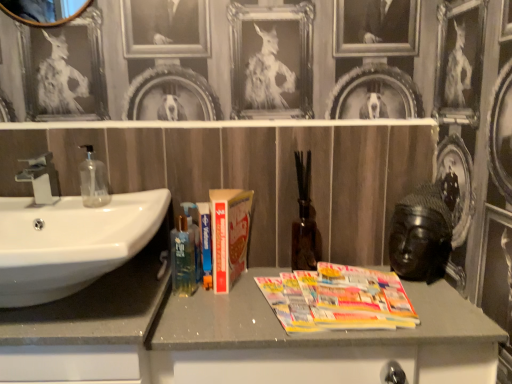
You are a GUI agent. You are given a task and a screenshot of the screen. Output one action in this format:
    pyautogui.click(x=<x>, y=<y>)
    Task: Click on the wooden mirror at upper left
    
    Given the screenshot: What is the action you would take?
    pyautogui.click(x=44, y=11)

What is the approximate height of white glossy sink at left?

19.51 centimeters.

At what (x,y) coordinates should I click in order to perform the action: click on matte gray cabinet at center. Please return your answer as a coordinate pair (x, y). Looking at the image, I should click on (318, 341).

What is the approximate width of matte silver faucet at left?

12.19 centimeters.

What is the approximate width of hardcover book at center?

It is 6.63 inches.

What do you see at coordinates (338, 299) in the screenshot? This screenshot has height=384, width=512. I see `multicolored glossy magazines at center` at bounding box center [338, 299].

You are a GUI agent. You are given a task and a screenshot of the screen. Output one action in this format:
    pyautogui.click(x=<x>, y=<y>)
    Task: Click on the translucent plastic mouthwash at lower left
    This screenshot has height=384, width=512.
    Given the screenshot: What is the action you would take?
    pyautogui.click(x=183, y=259)

What's the angular difference between white glossy sink at left and hardcover book at center's facing directions?

The facing directions of white glossy sink at left and hardcover book at center are 1.34 degrees apart.

Who is taller, white glossy sink at left or hardcover book at center?

With more height is hardcover book at center.

From a real-world perspective, is white glossy sink at left above or below hardcover book at center?

Clearly, from a real-world perspective, white glossy sink at left is above hardcover book at center.

Identify the location of paperback book located above the white glossy sink at left (from the image's perspective). The image size is (512, 384). (229, 235).

Between translucent plastic mouthwash at lower left and hardcover book at center, which one has smaller width?

With smaller width is hardcover book at center.

Is translucent plastic mouthwash at lower left looking in the opposite direction of hardcover book at center?

translucent plastic mouthwash at lower left is not turned away from hardcover book at center.

Locate an element on the screen. picture frame above the matte silver faucet at left (from a real-world perspective) is located at coordinates (44, 11).

Between wooden mirror at upper left and matte silver faucet at left, which one has larger size?

wooden mirror at upper left is bigger.

Which point is more distant from viewer, (x=32, y=5) or (x=41, y=187)?

Point (x=32, y=5)

Which of these two, wooden mirror at upper left or matte silver faucet at left, is thinner?

With smaller width is wooden mirror at upper left.

Is point (297, 305) closer or farther from the camera than point (270, 375)?

Point (297, 305) is farther from the camera than point (270, 375).

Is multicolored glossy magazines at center next to matte gray cabinet at center and touching it?

multicolored glossy magazines at center is not next to matte gray cabinet at center, and they're not touching.

From the image's perspective, which one is positioned higher, multicolored glossy magazines at center or matte gray cabinet at center?

From the image's view, multicolored glossy magazines at center is above.

Is multicolored glossy magazines at center oriented away from matte gray cabinet at center?

Yes.

Which object is closer to the camera taking this photo, multicolored glossy magazines at center or matte silver faucet at left?

multicolored glossy magazines at center.

From the image's perspective, relative to matte silver faucet at left, is multicolored glossy magazines at center above or below?

multicolored glossy magazines at center is situated lower than matte silver faucet at left in the image.

Which of these two, multicolored glossy magazines at center or matte silver faucet at left, is bigger?

Bigger between the two is matte silver faucet at left.

The height and width of the screenshot is (384, 512). Identify the location of magazine lying in front of the matte silver faucet at left. (338, 299).

Looking at their sizes, would you say matte gray cabinet at center is wider or thinner than multicolored glossy magazines at center?

Clearly, matte gray cabinet at center has more width compared to multicolored glossy magazines at center.

Is matte gray cabinet at center turned away from multicolored glossy magazines at center?

A: matte gray cabinet at center does not have its back to multicolored glossy magazines at center.

Based on their positions, is matte gray cabinet at center located to the left or right of multicolored glossy magazines at center?

matte gray cabinet at center is to the right of multicolored glossy magazines at center.

Is matte gray cabinet at center shorter than multicolored glossy magazines at center?

Incorrect, the height of matte gray cabinet at center does not fall short of that of multicolored glossy magazines at center.

Is translucent plastic mouthwash at lower left positioned behind matte silver faucet at left?

Yes, translucent plastic mouthwash at lower left is further from the viewer.

Can you confirm if translucent plastic mouthwash at lower left is taller than matte silver faucet at left?

Indeed, translucent plastic mouthwash at lower left has a greater height compared to matte silver faucet at left.

Which of these two, translucent plastic mouthwash at lower left or matte silver faucet at left, is thinner?

With smaller width is matte silver faucet at left.

How much distance is there between translucent plastic mouthwash at lower left and matte silver faucet at left?

The distance of translucent plastic mouthwash at lower left from matte silver faucet at left is 37.34 centimeters.

Image resolution: width=512 pixels, height=384 pixels. Find the location of `sink located above the hardcover book at center (from a real-world perspective)`. sink located above the hardcover book at center (from a real-world perspective) is located at coordinates (69, 240).

The height and width of the screenshot is (384, 512). Find the location of `mouthwash that is in front of the hardcover book at center`. mouthwash that is in front of the hardcover book at center is located at coordinates (183, 259).

From the image, which object appears to be nearer to multicolored glossy magazines at center, white glossy sink at left or wooden mirror at upper left?

white glossy sink at left lies closer to multicolored glossy magazines at center than the other object.

Based on their spatial positions, is matte silver faucet at left or translucent plastic mouthwash at lower left further from multicolored glossy magazines at center?

matte silver faucet at left lies further to multicolored glossy magazines at center than the other object.

From the image, which object appears to be farther from hardcover book at center, translucent plastic mouthwash at lower left or wooden mirror at upper left?

Based on the image, wooden mirror at upper left appears to be further to hardcover book at center.

Which object lies further to the anchor point wooden mirror at upper left, hardcover book at center or white glossy sink at left?

hardcover book at center.

From the image, which object appears to be nearer to translucent plastic mouthwash at lower left, hardcover book at center or wooden mirror at upper left?

hardcover book at center is positioned closer to the anchor translucent plastic mouthwash at lower left.

Based on the photo, estimate the real-world distances between objects in this image. Which object is further from hardcover book at center, matte gray cabinet at center or white glossy sink at left?

white glossy sink at left is further to hardcover book at center.

When comparing their distances from wooden mirror at upper left, does translucent plastic mouthwash at lower left or transparent glass soap dispenser at left seem closer?

transparent glass soap dispenser at left.

In the scene shown: When comparing their distances from matte gray cabinet at center, does matte silver faucet at left or white glossy sink at left seem closer?

Among the two, white glossy sink at left is located nearer to matte gray cabinet at center.

Image resolution: width=512 pixels, height=384 pixels. Find the location of `mouthwash situated between white glossy sink at left and matte gray cabinet at center from left to right`. mouthwash situated between white glossy sink at left and matte gray cabinet at center from left to right is located at coordinates (183, 259).

You are a GUI agent. You are given a task and a screenshot of the screen. Output one action in this format:
    pyautogui.click(x=<x>, y=<y>)
    Task: Click on the paperback book situated between white glossy sink at left and matte gray cabinet at center from left to right
    
    Given the screenshot: What is the action you would take?
    pyautogui.click(x=229, y=235)

Locate an element on the screen. This screenshot has height=384, width=512. mouthwash between wooden mirror at upper left and matte gray cabinet at center in the up-down direction is located at coordinates (183, 259).

Locate an element on the screen. The height and width of the screenshot is (384, 512). paperback book between wooden mirror at upper left and matte gray cabinet at center vertically is located at coordinates (229, 235).